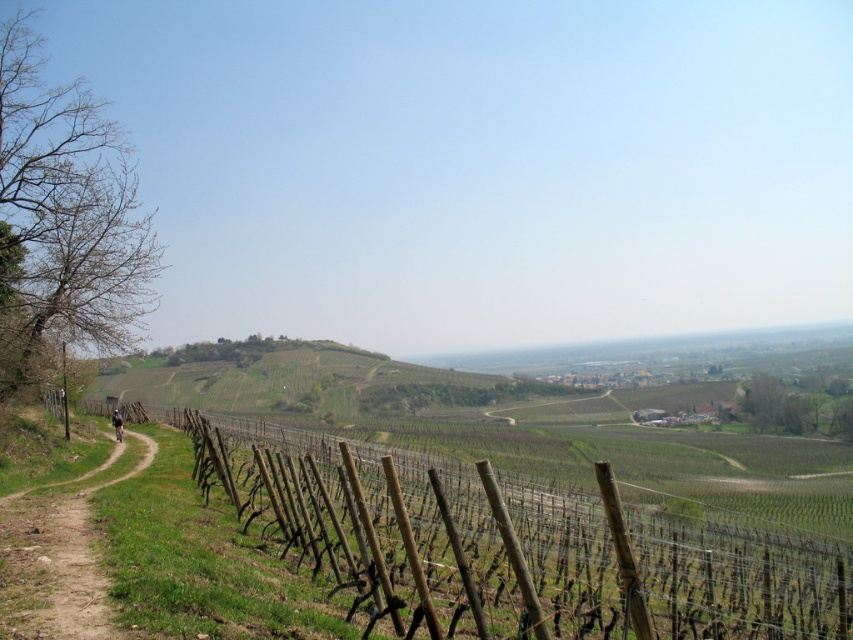
You are a gardener standing at the edge of the vineyard and need to determine which object is taller between the brown wooden fence at center and the brown dirt path at left. Based on the scene, which one is taller?

The brown wooden fence at center is taller than the brown dirt path at left.

You are a farmer planning to install a new irrigation system. You need to know which area has more space to accommodate the equipment. Based on the scene, which object has a greater width between the brown wooden fence at center and the brown dirt path at left?

The brown wooden fence at center has a greater width than the brown dirt path at left according to the description.

You are a tourist visiting the vineyard and want to take a photo of the brown wooden fence at center and the brown dirt path at left. Which object should you focus on first if you want to capture both in a single frame without moving your camera?

You should focus on the brown wooden fence at center first because it is larger in size compared to the brown dirt path at left, ensuring it remains prominent in the frame while the smaller path can still be included without needing to adjust the camera position.